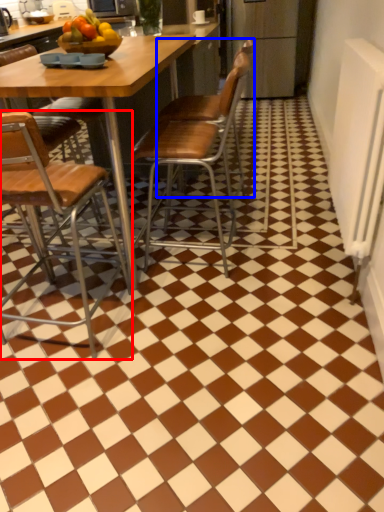
Question: Which object is closer to the camera taking this photo, chair (highlighted by a red box) or chair (highlighted by a blue box)?

Choices:
 (A) chair
 (B) chair

Answer: (A)